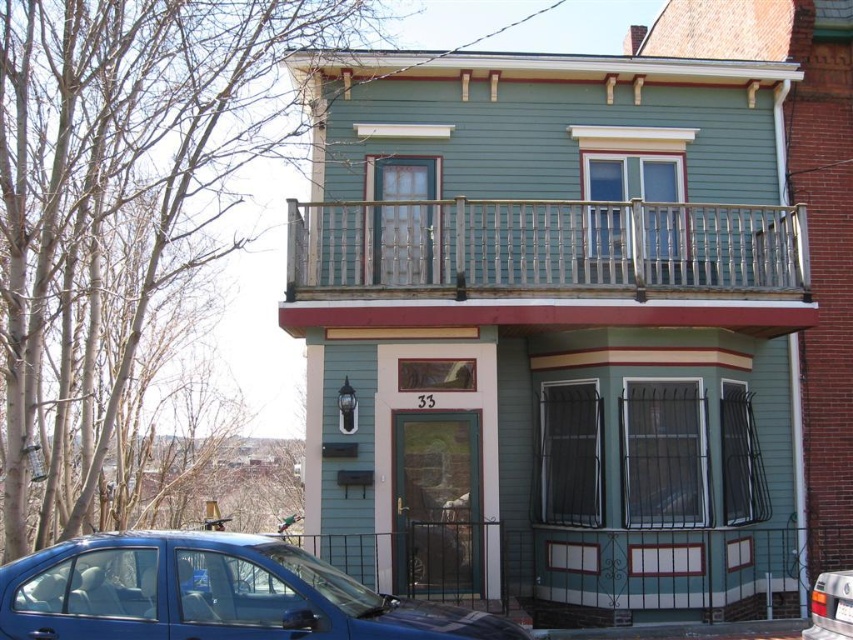
Question: Is wooden at upper center further to the viewer compared to metallic blue sedan at lower left?

Choices:
 (A) no
 (B) yes

Answer: (B)

Question: Can you confirm if metallic blue sedan at lower left is thinner than metallic silver car at lower right?

Choices:
 (A) no
 (B) yes

Answer: (A)

Question: Among these objects, which one is nearest to the camera?

Choices:
 (A) wooden at upper center
 (B) metallic blue sedan at lower left
 (C) metallic silver car at lower right

Answer: (B)

Question: Can you confirm if metallic blue sedan at lower left is smaller than metallic silver car at lower right?

Choices:
 (A) no
 (B) yes

Answer: (A)

Question: Which point is closer to the camera taking this photo?

Choices:
 (A) (33, 595)
 (B) (846, 637)

Answer: (A)

Question: Which object appears farthest from the camera in this image?

Choices:
 (A) metallic blue sedan at lower left
 (B) wooden at upper center

Answer: (B)